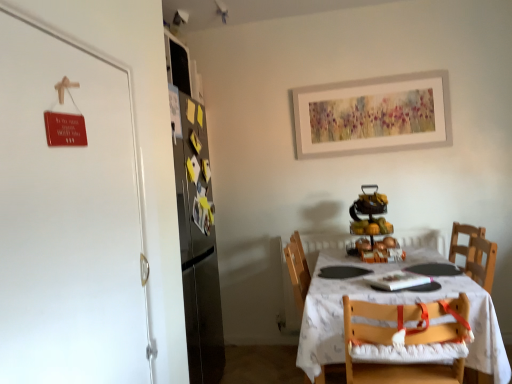
Identify the location of blank space above white matte door at left (from a real-world perspective). This screenshot has width=512, height=384. (69, 38).